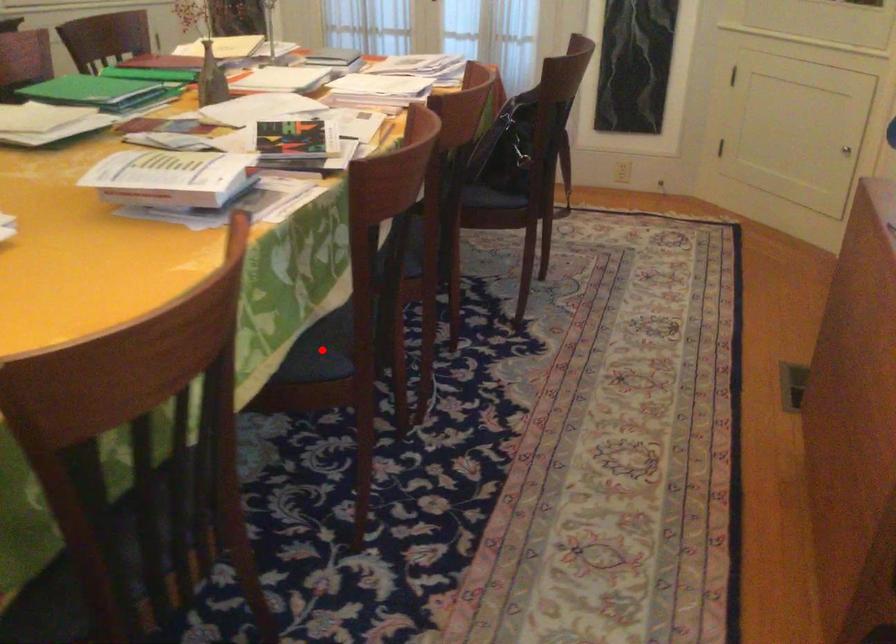
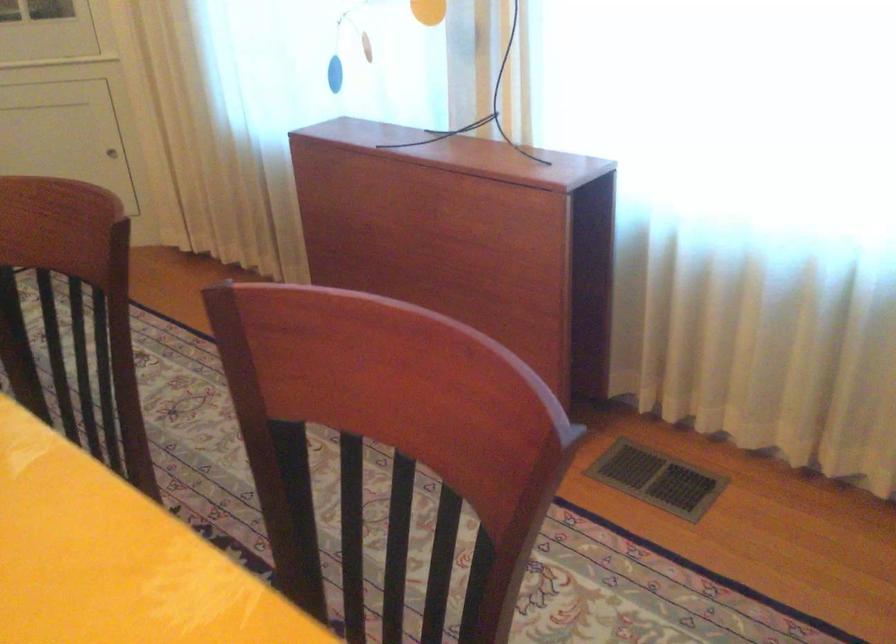
Question: I am providing you with two images of the same scene from different viewpoints. A red point is marked on the first image. Is the red point's position out of view in image 2?

Choices:
 (A) Yes
 (B) No

Answer: (A)